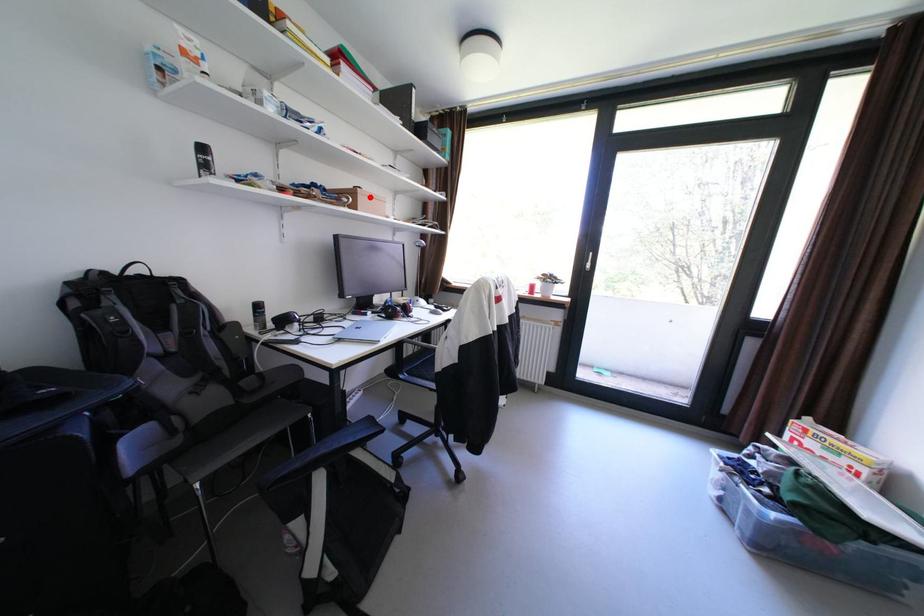
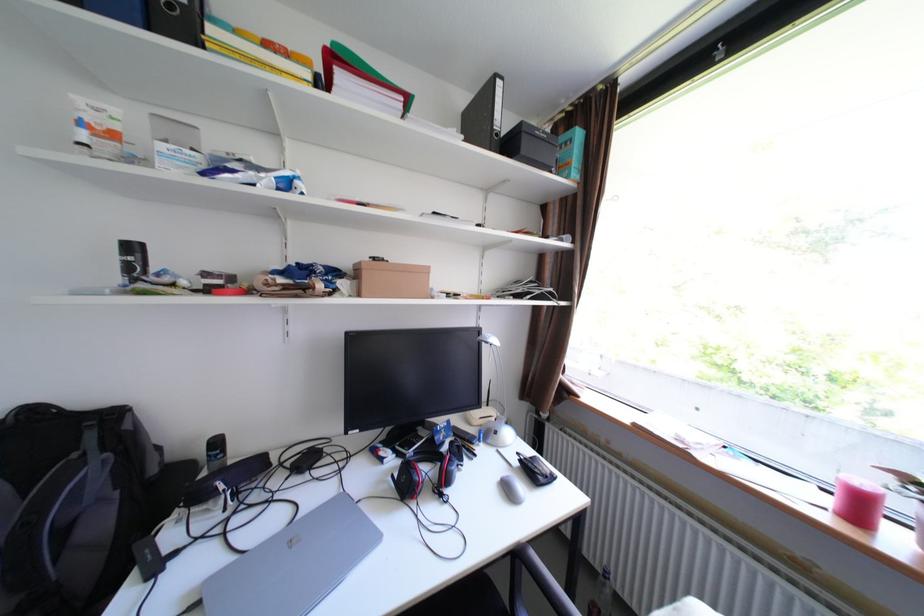
Find the pixel in the second image that matches the highlighted location in the first image.

(375, 275)